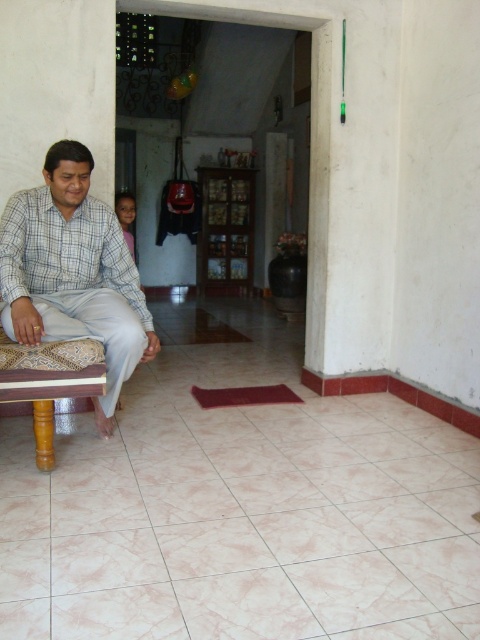
Is checkered fabric shirt at left closer to the viewer compared to dark skin boy at center?

Yes, checkered fabric shirt at left is closer to the viewer.

Does point (36, 214) come behind point (123, 202)?

No, it is not.

This screenshot has height=640, width=480. In order to click on checkered fabric shirt at left in this screenshot , I will do `click(72, 273)`.

Is checkered fabric shirt at left closer to camera compared to wooden stool at left?

No.

Between checkered fabric shirt at left and wooden stool at left, which one is positioned higher?

checkered fabric shirt at left is higher up.

Which is in front, point (14, 225) or point (22, 394)?

Point (22, 394) is in front.

At what (x,y) coordinates should I click in order to perform the action: click on checkered fabric shirt at left. Please return your answer as a coordinate pair (x, y). The width and height of the screenshot is (480, 640). Looking at the image, I should click on (72, 273).

What do you see at coordinates (48, 381) in the screenshot? I see `wooden stool at left` at bounding box center [48, 381].

In the scene shown: Who is more forward, (88, 364) or (127, 225)?

Point (88, 364) is in front.

Is point (2, 356) farther from viewer compared to point (116, 193)?

No, (2, 356) is closer to viewer.

Find the location of a particular element. The image size is (480, 640). wooden stool at left is located at coordinates [x=48, y=381].